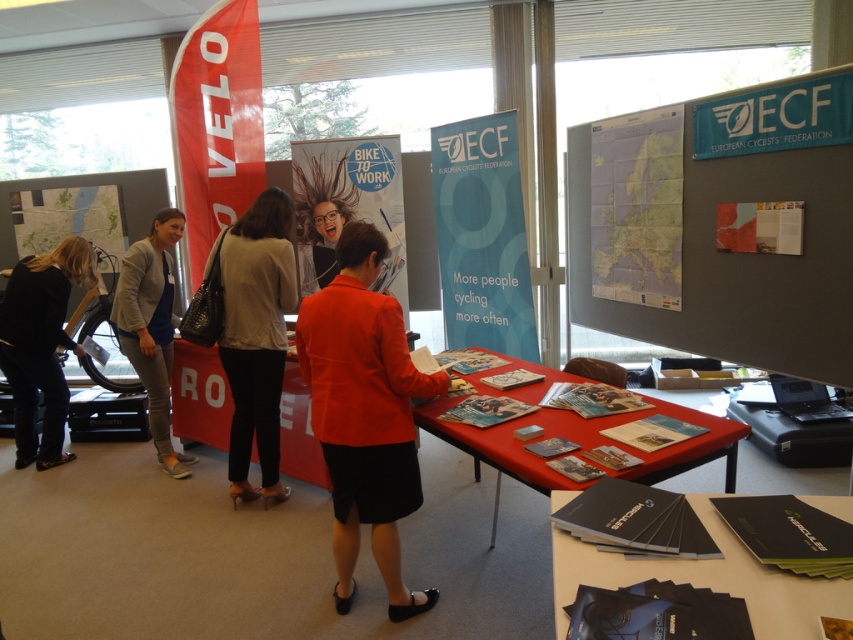
Question: Which object is closer to the camera taking this photo?

Choices:
 (A) black fabric at left
 (B) red fabric table at center

Answer: (B)

Question: Which of these objects is positioned farthest from the red fabric table at center?

Choices:
 (A) light beige sweater at center
 (B) matte gray map at upper right
 (C) black paper brochures at center
 (D) map paper at upper right

Answer: (A)

Question: Does black paper brochures at center appear over black fabric at left?

Choices:
 (A) yes
 (B) no

Answer: (B)

Question: Can you confirm if matte orange blazer at center is positioned to the right of red fabric table at center?

Choices:
 (A) yes
 (B) no

Answer: (B)

Question: Which is nearer to the red fabric banner at upper left?

Choices:
 (A) light beige sweater at center
 (B) matte orange blazer at center
 (C) gray knit cardigan at left
 (D) black fabric at left

Answer: (C)

Question: Can you confirm if map paper at upper right is positioned above black fabric at left?

Choices:
 (A) yes
 (B) no

Answer: (A)